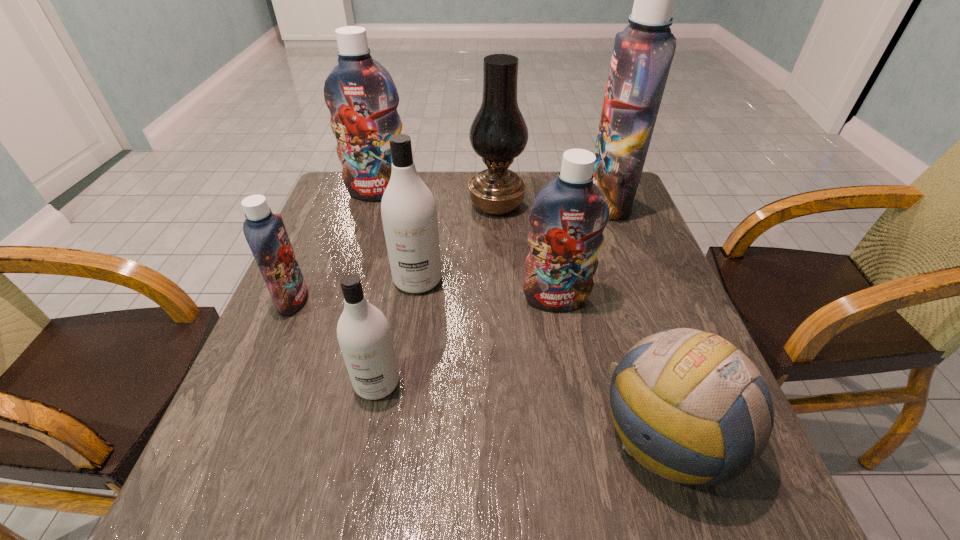
Locate an element on the screen. This screenshot has height=540, width=960. the seventh closest object to the third smallest blue shampoo is located at coordinates (689, 406).

Locate an element on the screen. Image resolution: width=960 pixels, height=540 pixels. object that can be found as the third closest to the brown oil lamp is located at coordinates (408, 209).

Point out which shampoo is positioned as the sixth nearest to the brown oil lamp. Please provide its 2D coordinates. Your answer should be formatted as a tuple, i.e. [(x, y)], where the tuple contains the x and y coordinates of a point satisfying the conditions above.

[(363, 332)]

Select which shampoo is the second closest to the shortest object. Please provide its 2D coordinates. Your answer should be formatted as a tuple, i.e. [(x, y)], where the tuple contains the x and y coordinates of a point satisfying the conditions above.

[(363, 332)]

The image size is (960, 540). I want to click on blue shampoo that stands as the closest to the smallest blue shampoo, so click(360, 93).

Locate which blue shampoo ranks second in proximity to the second blue shampoo from right to left. Please provide its 2D coordinates. Your answer should be formatted as a tuple, i.e. [(x, y)], where the tuple contains the x and y coordinates of a point satisfying the conditions above.

[(360, 93)]

This screenshot has height=540, width=960. What are the coordinates of `free space that satisfies the following two spatial constraints: 1. on the front-facing side of the shortest object; 2. on the left side of the bigger white shampoo` in the screenshot? It's located at (395, 435).

Where is `free space that satisfies the following two spatial constraints: 1. on the front label of the smallest blue shampoo; 2. on the back side of the shortest object`? This screenshot has width=960, height=540. free space that satisfies the following two spatial constraints: 1. on the front label of the smallest blue shampoo; 2. on the back side of the shortest object is located at coordinates (236, 435).

I want to click on blank area in the image that satisfies the following two spatial constraints: 1. on the front-facing side of the farther white shampoo; 2. on the front label of the smallest blue shampoo, so click(415, 301).

This screenshot has width=960, height=540. Find the location of `vacant region that satisfies the following two spatial constraints: 1. on the front label of the brown oil lamp; 2. on the right side of the second tallest shampoo`. vacant region that satisfies the following two spatial constraints: 1. on the front label of the brown oil lamp; 2. on the right side of the second tallest shampoo is located at coordinates (374, 205).